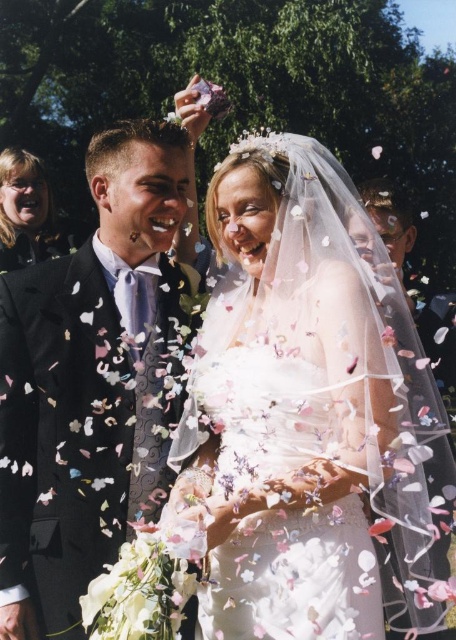
Is black satin suit at left thinner than matte black jacket at upper left?

In fact, black satin suit at left might be wider than matte black jacket at upper left.

The image size is (456, 640). Describe the element at coordinates (88, 381) in the screenshot. I see `black satin suit at left` at that location.

Is point (167, 264) less distant than point (27, 176)?

That is True.

This screenshot has height=640, width=456. Find the location of `black satin suit at left`. black satin suit at left is located at coordinates (88, 381).

Looking at this image, does white satin dress at center have a greater width compared to black satin suit at left?

Yes, white satin dress at center is wider than black satin suit at left.

Who is more distant from viewer, (316, 576) or (125, 452)?

The point (125, 452) is more distant.

Where is `white satin dress at center`? This screenshot has height=640, width=456. white satin dress at center is located at coordinates (293, 410).

Where is `white satin dress at center`? white satin dress at center is located at coordinates (293, 410).

Who is positioned more to the left, white satin dress at center or matte black jacket at upper left?

matte black jacket at upper left is more to the left.

Does point (383, 416) come closer to viewer compared to point (43, 253)?

Yes.

You are a GUI agent. You are given a task and a screenshot of the screen. Output one action in this format:
    pyautogui.click(x=<x>, y=<y>)
    Task: Click on the white satin dress at center
    
    Given the screenshot: What is the action you would take?
    pyautogui.click(x=293, y=410)